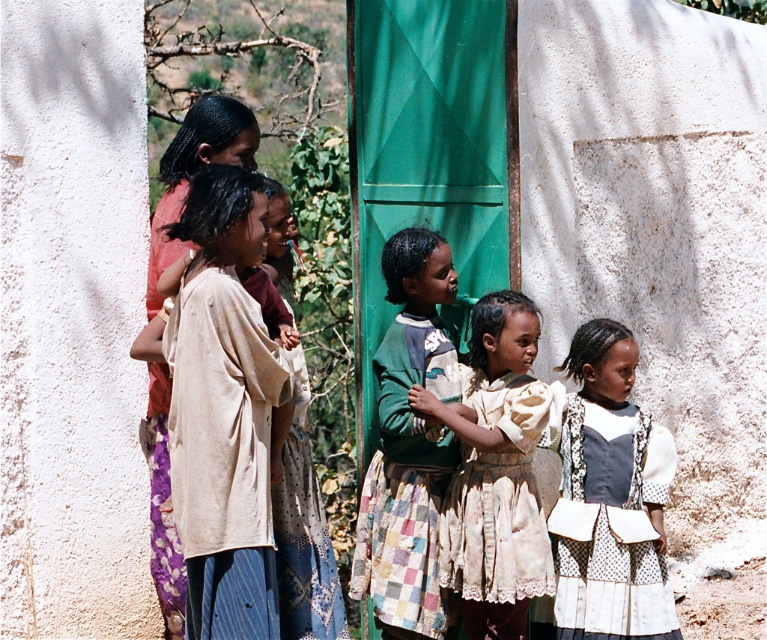
Based on the photo, you are standing in front of the building with the green door and notice two points marked on the wall. The first point is at coordinates point (525, 429) and the second is at point (150, 376). Which of these two points is nearer to you?

Point (525, 429) is closer to the viewer than point (150, 376).

Consider the image. You are a photographer trying to capture a photo of the children. You want to ensure that the white dotted dress at center and the beige fabric dress at left are both visible in the frame. Based on their positions, which dress should you focus on first to include both in the shot?

Since the white dotted dress at center is to the right of the beige fabric dress at left, you should focus on the beige fabric dress at left first to ensure both are in the frame.

You are a photographer trying to capture both the light beige lace dress at center and the beige fabric dress at left in a single shot. Based on their positions and sizes, which dress should you focus on to ensure both are visible in the frame?

The light beige lace dress at center might be wider than the beige fabric dress at left, so focusing on the center dress could help include both in the frame as it occupies more space.